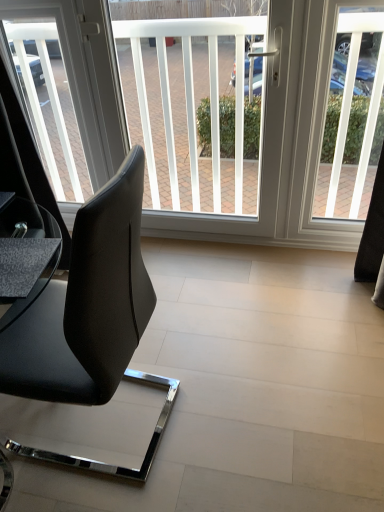
You are a GUI agent. You are given a task and a screenshot of the screen. Output one action in this format:
    pyautogui.click(x=<x>, y=<y>)
    Task: Click on the vacant space in between black leather chair at left and white plastic window screen at center, which is counted as the 2th window screen, starting from the right
    The height and width of the screenshot is (512, 384).
    Given the screenshot: What is the action you would take?
    pyautogui.click(x=203, y=302)